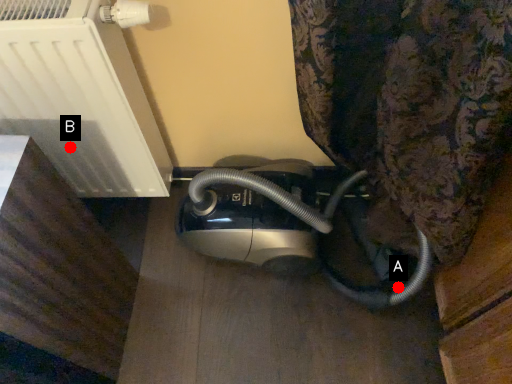
Question: Two points are circled on the image, labeled by A and B beside each circle. Which point is farther from the camera taking this photo?

Choices:
 (A) A is further
 (B) B is further

Answer: (A)